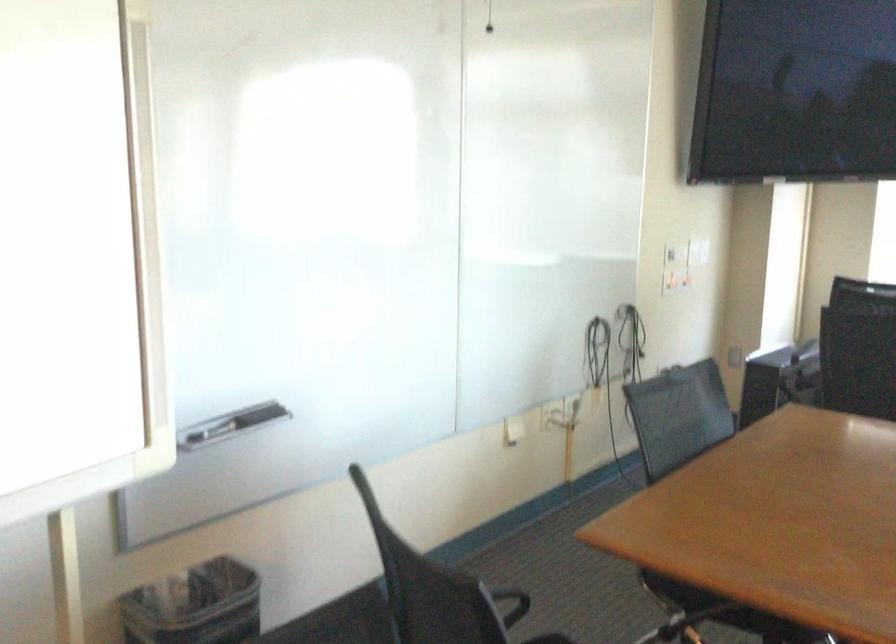
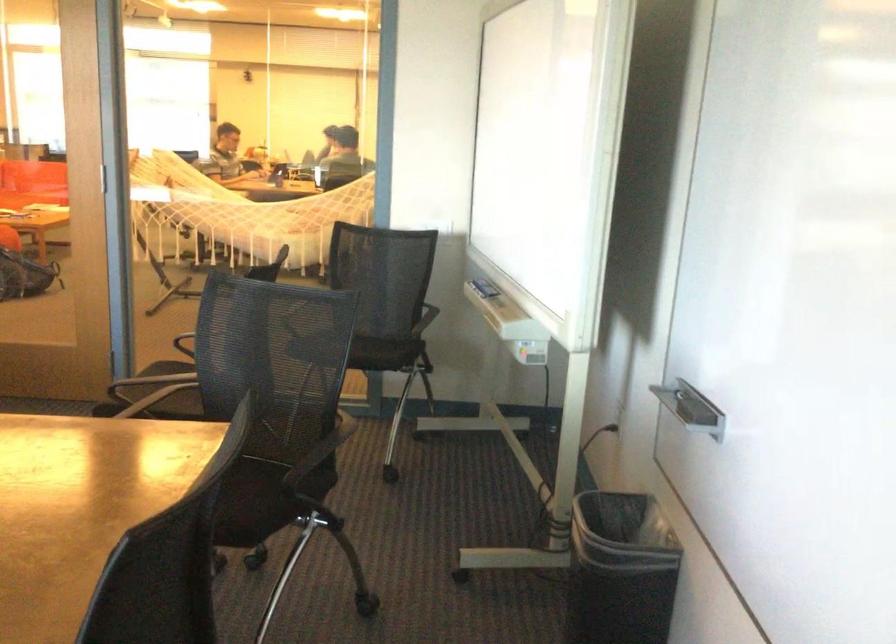
In the second image, find the point that corresponds to (281,413) in the first image.

(691, 408)